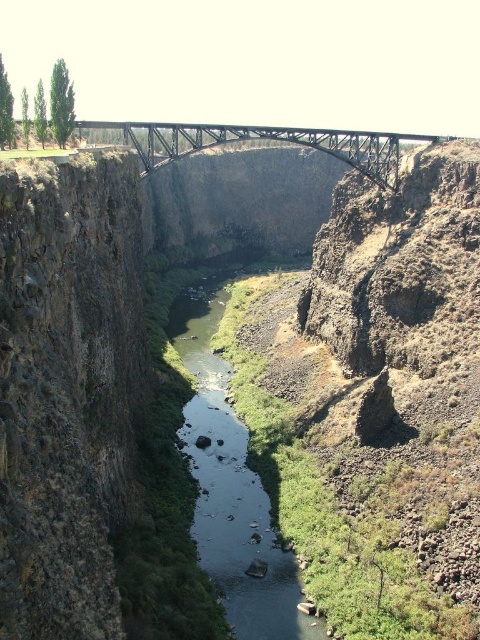
You are a hiker standing on the trail above the canyon. You see the green smooth water at center and the metallic steel bridge at center. Which one is closer to you?

The green smooth water at center is closer to you because it is in front of the metallic steel bridge at center.